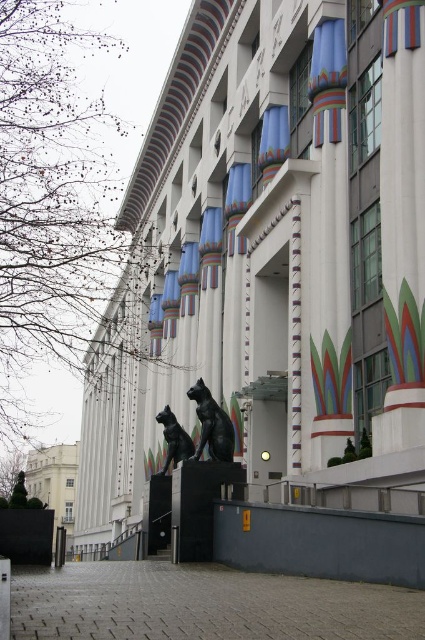
Question: Is the position of blue fabric curtain at upper center less distant than that of black polished stone cat at lower center?

Choices:
 (A) no
 (B) yes

Answer: (B)

Question: Which of the following is the farthest from the observer?

Choices:
 (A) (184, 454)
 (B) (320, 144)

Answer: (A)

Question: Is blue fabric curtain at upper center below black polished stone cat at lower center?

Choices:
 (A) no
 (B) yes

Answer: (A)

Question: Among these points, which one is nearest to the camera?

Choices:
 (A) (180, 449)
 (B) (337, 35)

Answer: (B)

Question: Can you confirm if blue fabric curtain at upper center is thinner than black polished stone cat at lower center?

Choices:
 (A) no
 (B) yes

Answer: (B)

Question: Which of the following is the closest to the observer?

Choices:
 (A) (340, 99)
 (B) (164, 417)

Answer: (A)